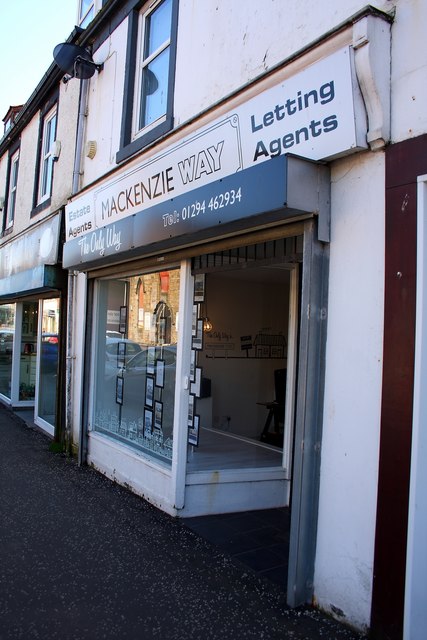
Identify the location of door. This screenshot has height=640, width=427. (26, 393).